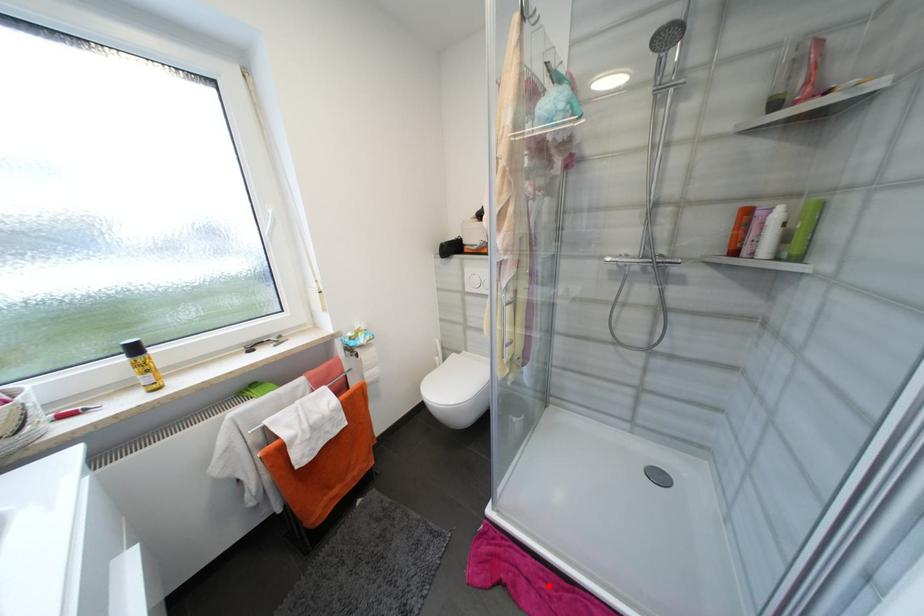
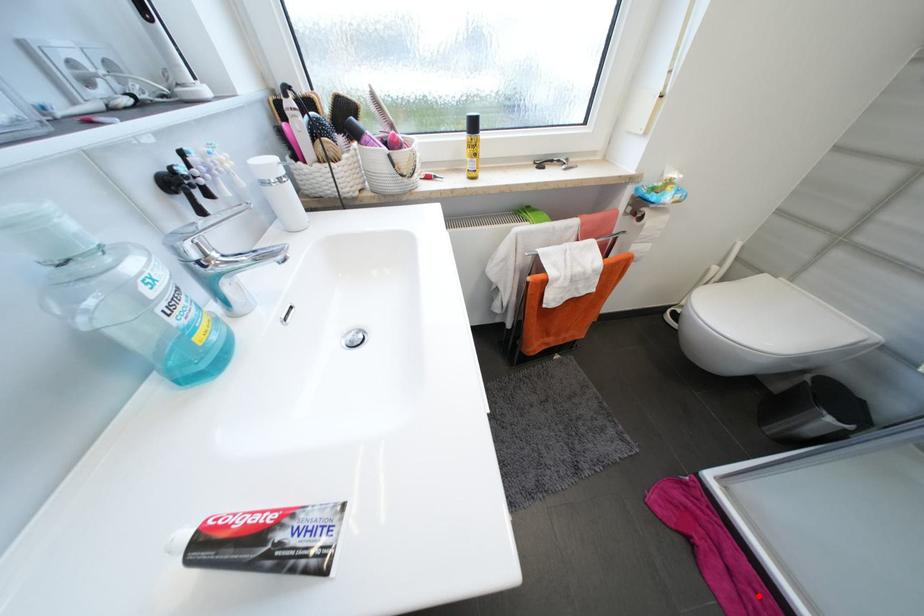
I am providing you with two images of the same scene from different viewpoints. A red point is marked on the first image and another point is marked on the second image. Is the red point in image1 aligned with the point shown in image2?

Yes